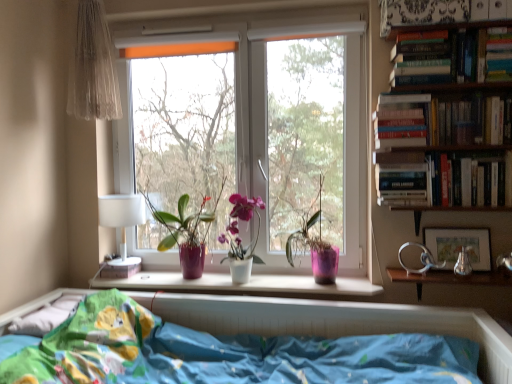
Question: Is translucent fabric curtain at upper left shorter than blue fabric bed at lower center?

Choices:
 (A) yes
 (B) no

Answer: (B)

Question: From the image's perspective, is translucent fabric curtain at upper left on blue fabric bed at lower center?

Choices:
 (A) no
 (B) yes

Answer: (B)

Question: Is blue fabric bed at lower center surrounded by translucent fabric curtain at upper left?

Choices:
 (A) yes
 (B) no

Answer: (B)

Question: Does translucent fabric curtain at upper left appear on the right side of blue fabric bed at lower center?

Choices:
 (A) no
 (B) yes

Answer: (A)

Question: Can you confirm if translucent fabric curtain at upper left is bigger than blue fabric bed at lower center?

Choices:
 (A) no
 (B) yes

Answer: (A)

Question: Considering the positions of blue fabric bed at lower center and hardcover books at upper right, which is the 3th book from top to bottom, in the image, is blue fabric bed at lower center bigger or smaller than hardcover books at upper right, which is the 3th book from top to bottom,?

Choices:
 (A) big
 (B) small

Answer: (A)

Question: From a real-world perspective, is blue fabric bed at lower center physically located above or below hardcover books at upper right, which is the 3th book from top to bottom?

Choices:
 (A) below
 (B) above

Answer: (A)

Question: In the image, is blue fabric bed at lower center positioned in front of or behind hardcover books at upper right, arranged as the second book when ordered from the bottom?

Choices:
 (A) front
 (B) behind

Answer: (A)

Question: Is blue fabric bed at lower center wider or thinner than hardcover books at upper right, which is the 3th book from top to bottom?

Choices:
 (A) wide
 (B) thin

Answer: (A)

Question: Is metallic silver table at right taller or shorter than translucent fabric curtain at upper left?

Choices:
 (A) tall
 (B) short

Answer: (B)

Question: From the image's perspective, is metallic silver table at right located above or below translucent fabric curtain at upper left?

Choices:
 (A) above
 (B) below

Answer: (B)

Question: Considering the positions of metallic silver table at right and translucent fabric curtain at upper left in the image, is metallic silver table at right bigger or smaller than translucent fabric curtain at upper left?

Choices:
 (A) small
 (B) big

Answer: (A)

Question: Considering the positions of point (434, 271) and point (81, 36), is point (434, 271) closer or farther from the camera than point (81, 36)?

Choices:
 (A) farther
 (B) closer

Answer: (B)

Question: In the image, is pink matte pot at center, the first houseplant positioned from the right, positioned in front of or behind hardcover book at upper right, acting as the 2th paperback book starting from the top?

Choices:
 (A) behind
 (B) front

Answer: (A)

Question: Is pink matte pot at center, the first houseplant positioned from the right, situated inside hardcover book at upper right, the second paperback book from the right, or outside?

Choices:
 (A) inside
 (B) outside

Answer: (B)